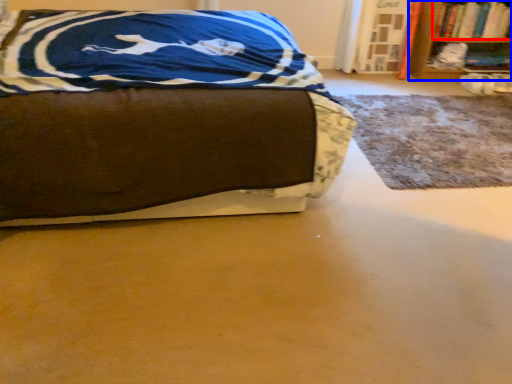
Question: Among these objects, which one is farthest to the camera, book (highlighted by a red box) or bookcase (highlighted by a blue box)?

Choices:
 (A) book
 (B) bookcase

Answer: (A)